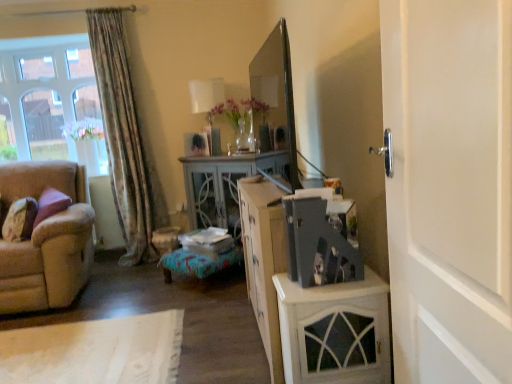
Image resolution: width=512 pixels, height=384 pixels. I want to click on white painted wood door at right, so click(449, 187).

What do you see at coordinates (319, 244) in the screenshot? The image size is (512, 384). I see `matte gray photo album at center` at bounding box center [319, 244].

What is the approximate width of clear glass window at upper left?

clear glass window at upper left is 16.26 inches in width.

This screenshot has height=384, width=512. Identify the location of clear glass window at upper left. (52, 101).

What do you see at coordinates (20, 220) in the screenshot?
I see `velvet purple pillow at left` at bounding box center [20, 220].

Where is `white painted wood cabinet at right`? white painted wood cabinet at right is located at coordinates (335, 331).

Where is `white painted wood door at right`? This screenshot has width=512, height=384. white painted wood door at right is located at coordinates (449, 187).

Considering the relative positions of velvet purple pillow at left and clear glass window at upper left in the image provided, is velvet purple pillow at left to the left of clear glass window at upper left from the viewer's perspective?

No.

Is the depth of velvet purple pillow at left greater than that of clear glass window at upper left?

No, the depth of velvet purple pillow at left is less than that of clear glass window at upper left.

Is velvet purple pillow at left oriented towards clear glass window at upper left?

No, velvet purple pillow at left is not aimed at clear glass window at upper left.

Which of these two, velvet purple pillow at left or clear glass window at upper left, stands taller?

Standing taller between the two is clear glass window at upper left.

Where is `desk that appears behind the matte gray photo album at center`? The image size is (512, 384). desk that appears behind the matte gray photo album at center is located at coordinates (223, 185).

Which object is thinner, matte gray photo album at center or light gray wood desk at center?

matte gray photo album at center.

Between point (293, 246) and point (190, 188), which one is positioned in front?

Point (293, 246)

Which is less distant, (57, 246) or (339, 252)?

Point (57, 246).

Where is `appliance located on the right of beige fabric couch at left`? The image size is (512, 384). appliance located on the right of beige fabric couch at left is located at coordinates (319, 244).

Is beige fabric couch at left oriented away from matte gray photo album at center?

That's not correct — beige fabric couch at left is not looking away from matte gray photo album at center.

From the picture: Can you confirm if beige fabric couch at left is positioned to the right of matte gray photo album at center?

No, beige fabric couch at left is not to the right of matte gray photo album at center.

Is point (9, 122) positioned before point (352, 232)?

No, (9, 122) is further to viewer.

From the image's perspective, which one is positioned lower, clear glass window at upper left or matte gray photo album at center?

matte gray photo album at center.

Is clear glass window at upper left closer to the viewer compared to matte gray photo album at center?

No, clear glass window at upper left is further to the viewer.

You are a GUI agent. You are given a task and a screenshot of the screen. Output one action in this format:
    pyautogui.click(x=<x>, y=<y>)
    Task: Click on the appliance in front of the clear glass window at upper left
    
    Given the screenshot: What is the action you would take?
    pyautogui.click(x=319, y=244)

The height and width of the screenshot is (384, 512). In order to click on curtain behind the white painted wood cabinet at right in this screenshot , I will do `click(122, 135)`.

Does floral fabric curtain at left have a smaller size compared to white painted wood cabinet at right?

No, floral fabric curtain at left is not smaller than white painted wood cabinet at right.

Measure the distance between floral fabric curtain at left and white painted wood cabinet at right.

floral fabric curtain at left is 8.47 feet from white painted wood cabinet at right.

From the image's perspective, is velvet purple pillow at left under light gray wood desk at center?

Yes, from the image's perspective, velvet purple pillow at left is beneath light gray wood desk at center.

Who is smaller, velvet purple pillow at left or light gray wood desk at center?

With smaller size is velvet purple pillow at left.

Would you say velvet purple pillow at left is outside light gray wood desk at center?

Yes.

What's the angular difference between velvet purple pillow at left and light gray wood desk at center's facing directions?

There is a 15.4-degree angle between the facing directions of velvet purple pillow at left and light gray wood desk at center.

This screenshot has height=384, width=512. In the image, there is a floral fabric curtain at left. Identify the location of appliance below it (from the image's perspective). pos(319,244).

Is matte gray photo album at center beside floral fabric curtain at left?

There is a gap between matte gray photo album at center and floral fabric curtain at left.

From the picture: Is matte gray photo album at center taller than floral fabric curtain at left?

No, matte gray photo album at center is not taller than floral fabric curtain at left.

Does matte gray photo album at center contain floral fabric curtain at left?

No, floral fabric curtain at left is located outside of matte gray photo album at center.

The height and width of the screenshot is (384, 512). I want to click on window located above the velvet purple pillow at left (from the image's perspective), so click(x=52, y=101).

This screenshot has height=384, width=512. Find the location of `appliance in front of the light gray wood desk at center`. appliance in front of the light gray wood desk at center is located at coordinates (319, 244).

When comparing their distances from velvet purple pillow at left, does floral fabric curtain at left or matte gray photo album at center seem further?

The object further to velvet purple pillow at left is matte gray photo album at center.

Which object lies nearer to the anchor point white painted wood door at right, clear glass window at upper left or beige fabric couch at left?

beige fabric couch at left is positioned closer to the anchor white painted wood door at right.

Based on their spatial positions, is light gray wood desk at center or white painted wood door at right further from matte gray photo album at center?

light gray wood desk at center is positioned further to the anchor matte gray photo album at center.

Based on their spatial positions, is white painted wood door at right or beige fabric couch at left further from white painted wood cabinet at right?

beige fabric couch at left.

Considering their positions, is beige fabric couch at left positioned further to velvet purple pillow at left than white painted wood door at right?

The object further to velvet purple pillow at left is white painted wood door at right.

Which object lies further to the anchor point floral fabric curtain at left, velvet purple pillow at left or white painted wood door at right?

white painted wood door at right lies further to floral fabric curtain at left than the other object.

Looking at the image, which one is located closer to white painted wood door at right, clear glass window at upper left or floral fabric curtain at left?

floral fabric curtain at left is positioned closer to the anchor white painted wood door at right.

When comparing their distances from light gray wood desk at center, does white painted wood door at right or velvet purple pillow at left seem further?

Among the two, white painted wood door at right is located further to light gray wood desk at center.

In order to click on pillow positioned between beige fabric couch at left and clear glass window at upper left from near to far in this screenshot , I will do pos(20,220).

This screenshot has width=512, height=384. What are the coordinates of `appliance between beige fabric couch at left and white painted wood door at right` in the screenshot? It's located at [319, 244].

I want to click on curtain between velvet purple pillow at left and white painted wood cabinet at right in the horizontal direction, so click(122, 135).

The height and width of the screenshot is (384, 512). Identify the location of appliance between white painted wood cabinet at right and light gray wood desk at center from front to back. (319, 244).